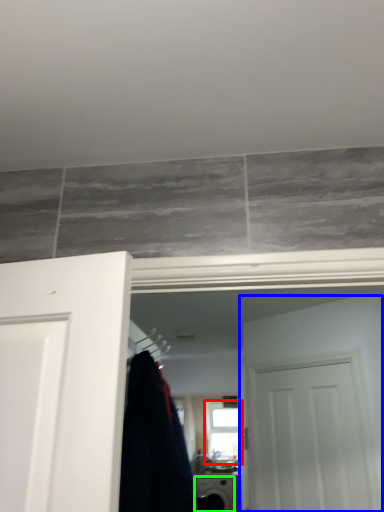
Question: Which object is the farthest from window (highlighted by a red box)? Choose among these: door (highlighted by a blue box) or appliance (highlighted by a green box).

Choices:
 (A) door
 (B) appliance

Answer: (A)